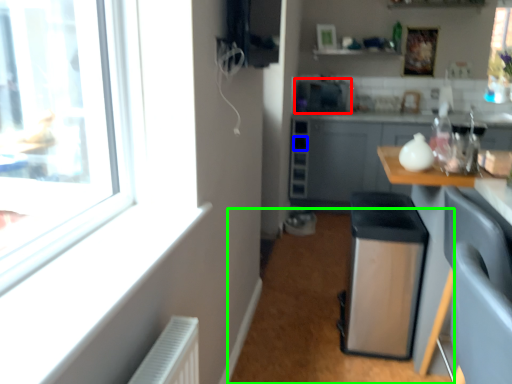
Question: Which object is the farthest from appliance (highlighted by a red box)? Choose among these: drawer (highlighted by a blue box) or plain (highlighted by a green box).

Choices:
 (A) drawer
 (B) plain

Answer: (B)